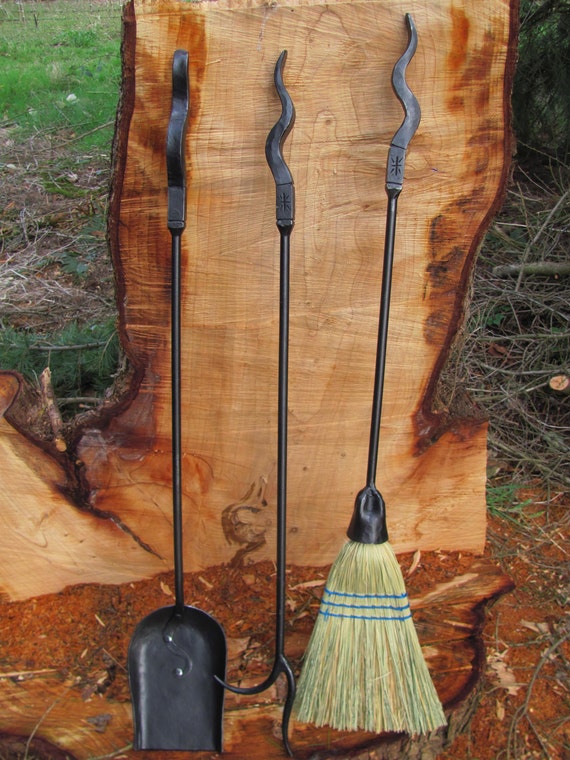
Locate an element on the screen. Image resolution: width=570 pixels, height=760 pixels. dark brown part of wood in background is located at coordinates (148, 273), (439, 312), (138, 434).